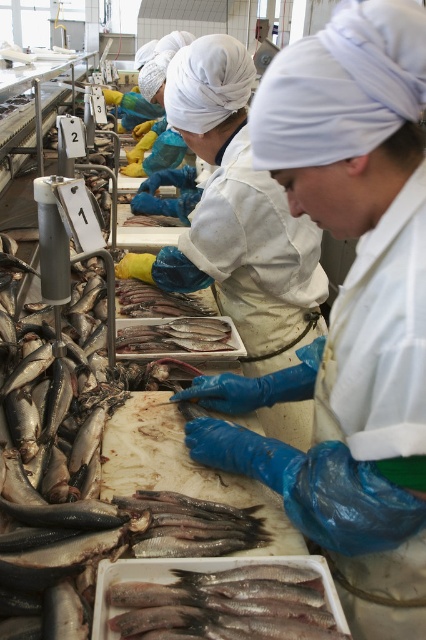
Question: Which point is farther to the camera?

Choices:
 (A) pyautogui.click(x=284, y=358)
 (B) pyautogui.click(x=187, y=324)

Answer: (B)

Question: Which point is farther to the camera?

Choices:
 (A) (144, 333)
 (B) (206, 40)

Answer: (A)

Question: Is blue rubber gloves at center further to the viewer compared to shiny silver fish at center?

Choices:
 (A) yes
 (B) no

Answer: (B)

Question: Which of the following is the closest to the observer?

Choices:
 (A) blue rubber gloves at center
 (B) silvery metallic fish at center

Answer: (B)

Question: Considering the relative positions of silvery metallic fish at center and shiny silver fish at center in the image provided, where is silvery metallic fish at center located with respect to shiny silver fish at center?

Choices:
 (A) above
 (B) below

Answer: (B)

Question: From the image, what is the correct spatial relationship of blue rubber gloves at center in relation to shiny silver fish at center?

Choices:
 (A) left
 (B) right

Answer: (B)